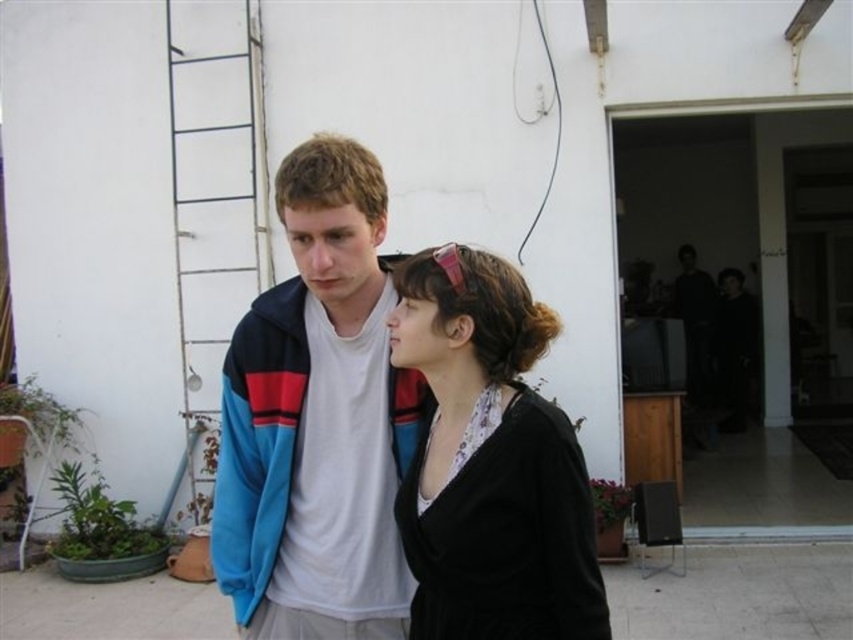
You are a photographer setting up for a group photo. You want to ensure everyone is visible. Given the blue fleece jacket at center and the black matte sweater at center, which one is blocking the view of the other?

The black matte sweater at center is behind the blue fleece jacket at center, so the blue fleece jacket at center is blocking the view of the black matte sweater at center.

You are trying to decide which garment to take with you for a chilly day. Both the blue fleece jacket at center and the black matte sweater at center are available. Based on their sizes, which one would be more suitable for keeping warm?

The blue fleece jacket at center is bigger than the black matte sweater at center, so it would provide more warmth and be more suitable for a chilly day.